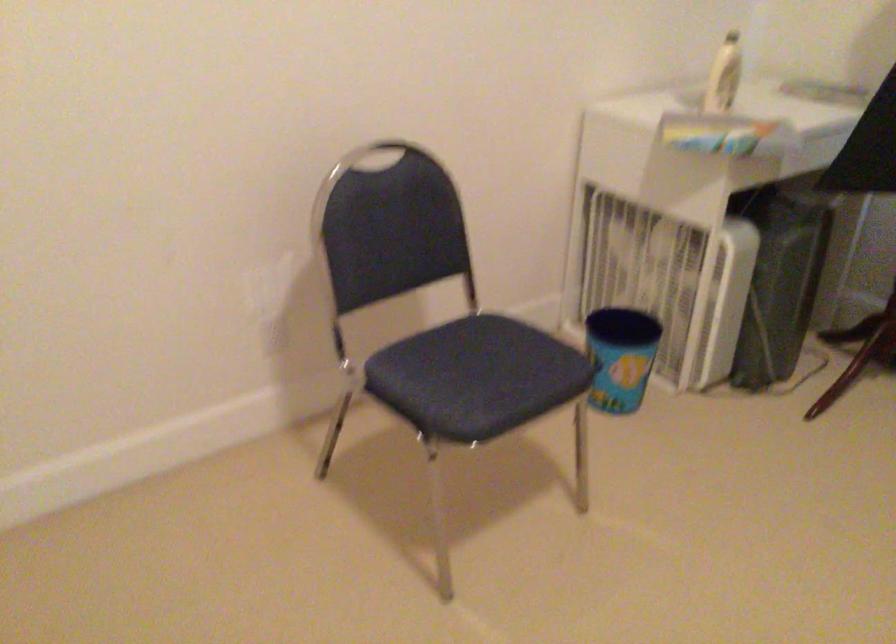
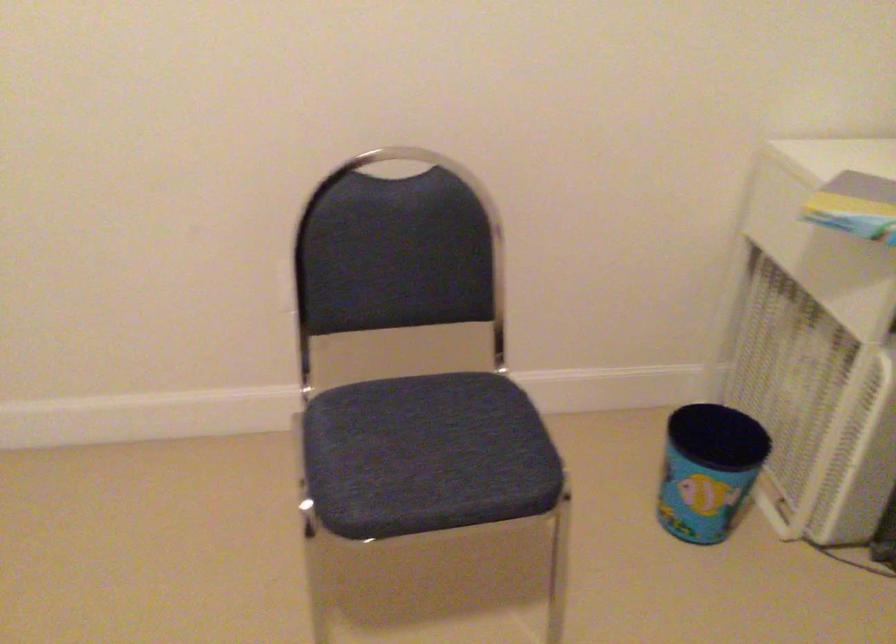
What movement of the cameraman would produce the second image?

The cameraman moved toward right, forward.